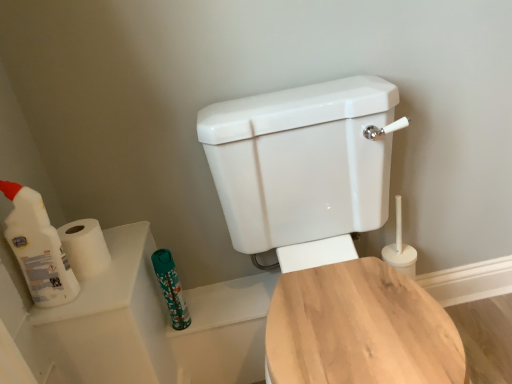
The image size is (512, 384). In order to click on vacant area that lies to the right of teal fabric toiletry at lower center in this screenshot , I will do `click(232, 299)`.